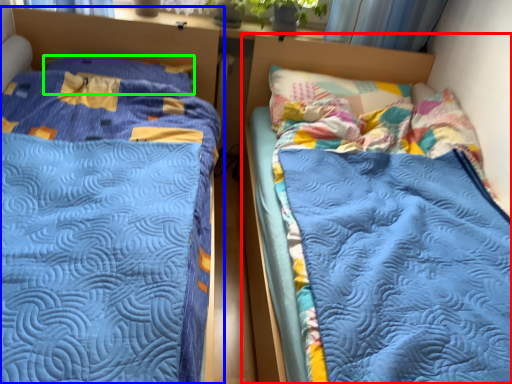
Question: Which is nearer to the bed (highlighted by a red box)? bed (highlighted by a blue box) or pillow (highlighted by a green box).

Choices:
 (A) bed
 (B) pillow

Answer: (B)